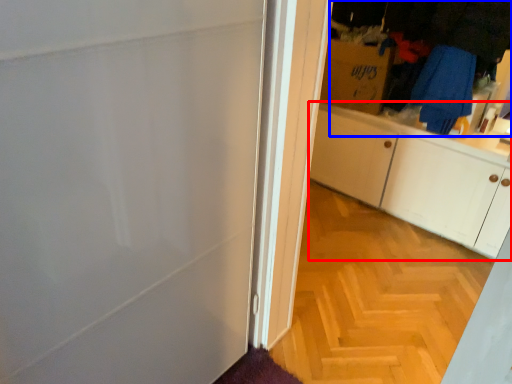
Question: Which object is closer to the camera taking this photo, cabinetry (highlighted by a red box) or laundry (highlighted by a blue box)?

Choices:
 (A) cabinetry
 (B) laundry

Answer: (A)